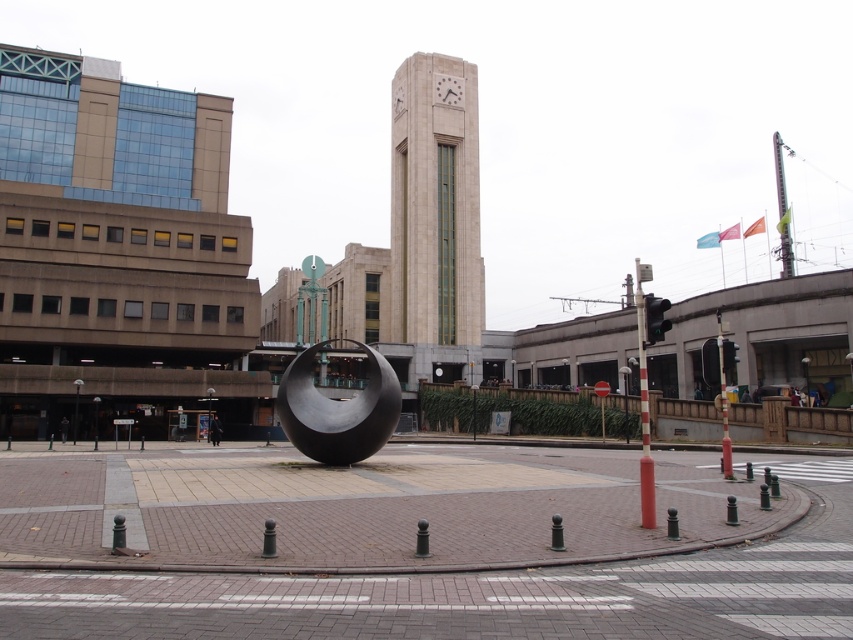
Where is `beige stone clock tower at center`? The height and width of the screenshot is (640, 853). beige stone clock tower at center is located at coordinates (434, 202).

Does beige stone clock tower at center have a smaller size compared to polished metal sphere at center?

No.

Is point (463, 253) more distant than point (340, 449)?

Yes, it is behind point (340, 449).

You are a GUI agent. You are given a task and a screenshot of the screen. Output one action in this format:
    pyautogui.click(x=<x>, y=<y>)
    Task: Click on the beige stone clock tower at center
    
    Given the screenshot: What is the action you would take?
    pyautogui.click(x=434, y=202)